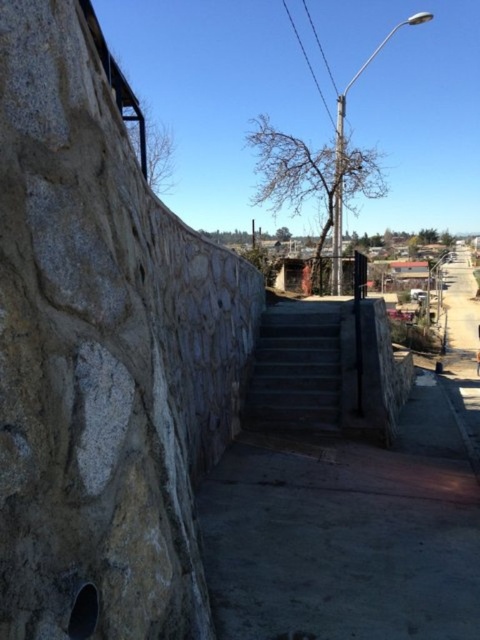
You are standing at the base of the stone wall and want to reach the point marked at coordinates (118, 445). Given that the stairs are 3 feet wide, can you walk directly to that point without stepping onto the stairs?

The point at (118, 445) is 5.50 feet away from the viewer. Since the stairs are only 3 feet wide, you would need to navigate around them to reach the point without stepping on the stairs. However, the distance provided does not indicate the path required to go around, so it is unclear if the 5.50 feet accounts for the detour. Without additional information about the layout, it is uncertain if the direct path is possible.

You are a painter who needs to know which object is taller between the natural stone wall at left and the dark gray concrete stairs at center. Based on the scene, which one is taller?

The natural stone wall at left is taller than the dark gray concrete stairs at center according to the description.